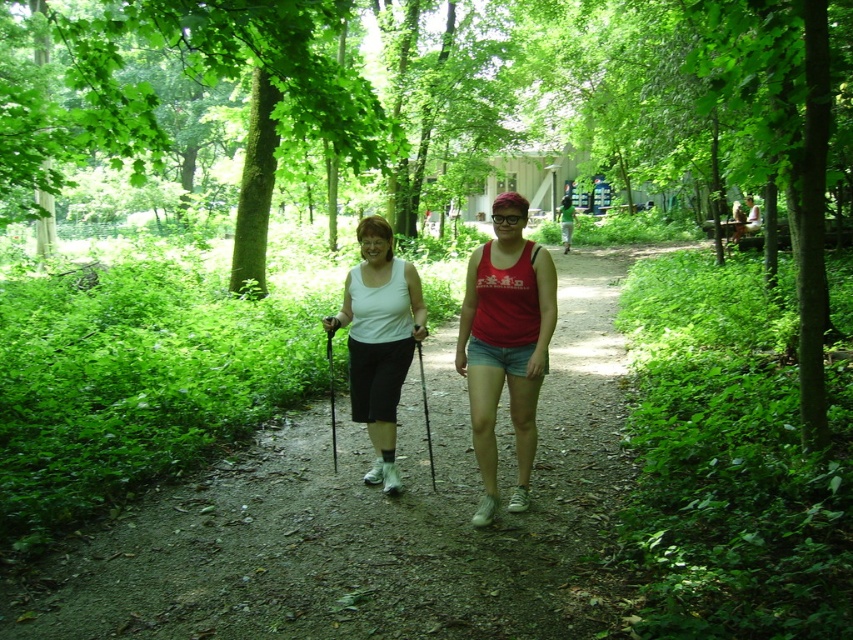
Question: Which point is closer to the camera?

Choices:
 (A) (380, 237)
 (B) (498, 266)

Answer: (B)

Question: Is red cotton tank top at center behind white matte tank top at center?

Choices:
 (A) yes
 (B) no

Answer: (B)

Question: Can you confirm if red cotton tank top at center is positioned above white matte tank top at center?

Choices:
 (A) no
 (B) yes

Answer: (A)

Question: Does red cotton tank top at center have a larger size compared to white matte tank top at center?

Choices:
 (A) no
 (B) yes

Answer: (A)

Question: Which point is farther to the camera?

Choices:
 (A) white matte tank top at center
 (B) red cotton tank top at center

Answer: (A)